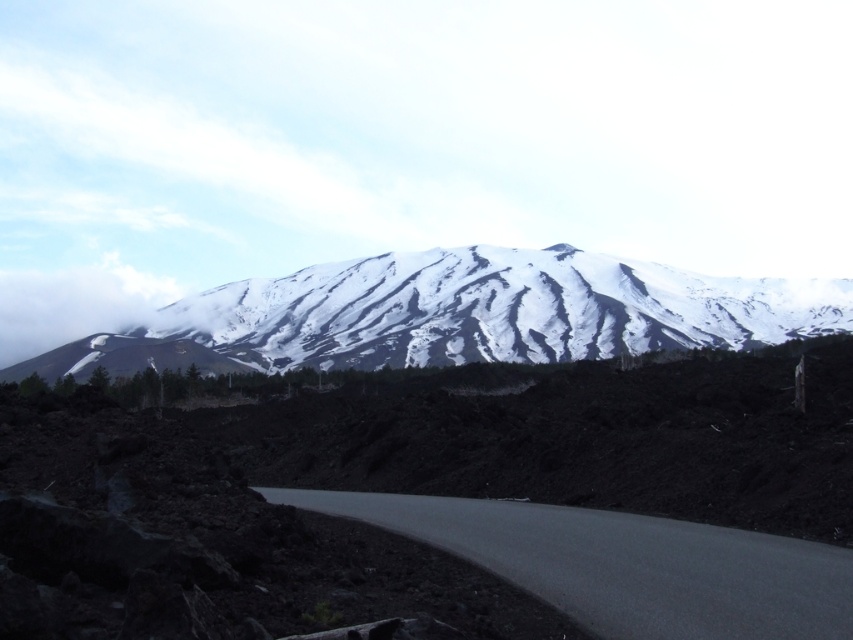
Does snowy volcanic peak at center have a smaller size compared to black asphalt road at center?

No.

Who is lower down, snowy volcanic peak at center or black asphalt road at center?

black asphalt road at center is below.

Describe the element at coordinates (457, 314) in the screenshot. I see `snowy volcanic peak at center` at that location.

Find the location of `snowy volcanic peak at center`. snowy volcanic peak at center is located at coordinates (457, 314).

Does black asphalt road at center have a greater width compared to white fluffy cloud at upper left?

Incorrect, black asphalt road at center's width does not surpass white fluffy cloud at upper left's.

You are a GUI agent. You are given a task and a screenshot of the screen. Output one action in this format:
    pyautogui.click(x=<x>, y=<y>)
    Task: Click on the black asphalt road at center
    
    Given the screenshot: What is the action you would take?
    pyautogui.click(x=624, y=564)

I want to click on black asphalt road at center, so click(624, 564).

Between snowy volcanic peak at center and white fluffy cloud at upper left, which one appears on the left side from the viewer's perspective?

white fluffy cloud at upper left is more to the left.

Who is shorter, snowy volcanic peak at center or white fluffy cloud at upper left?

Standing shorter between the two is snowy volcanic peak at center.

Which is behind, point (711, 316) or point (119, 262)?

The point (119, 262) is behind.

The image size is (853, 640). Find the location of `snowy volcanic peak at center`. snowy volcanic peak at center is located at coordinates (457, 314).